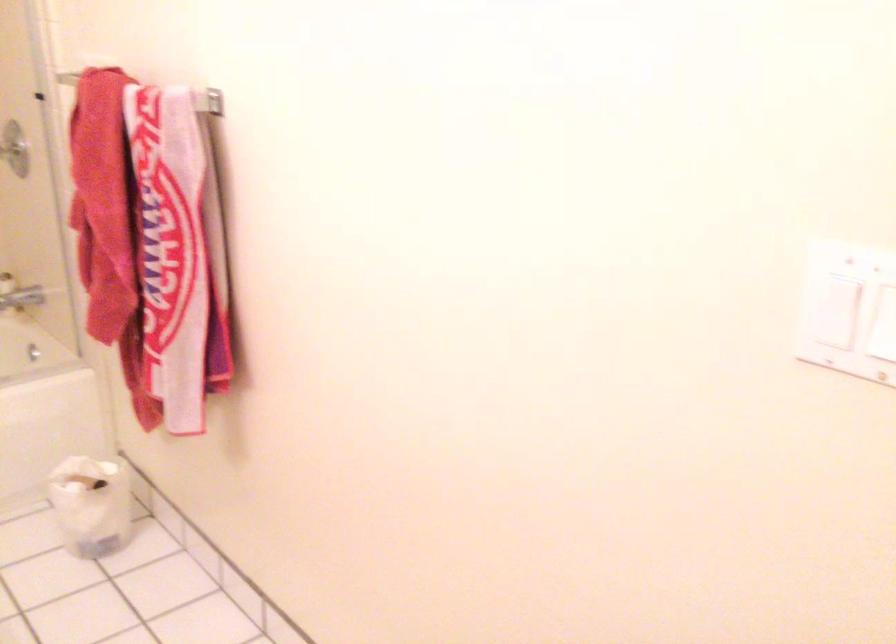
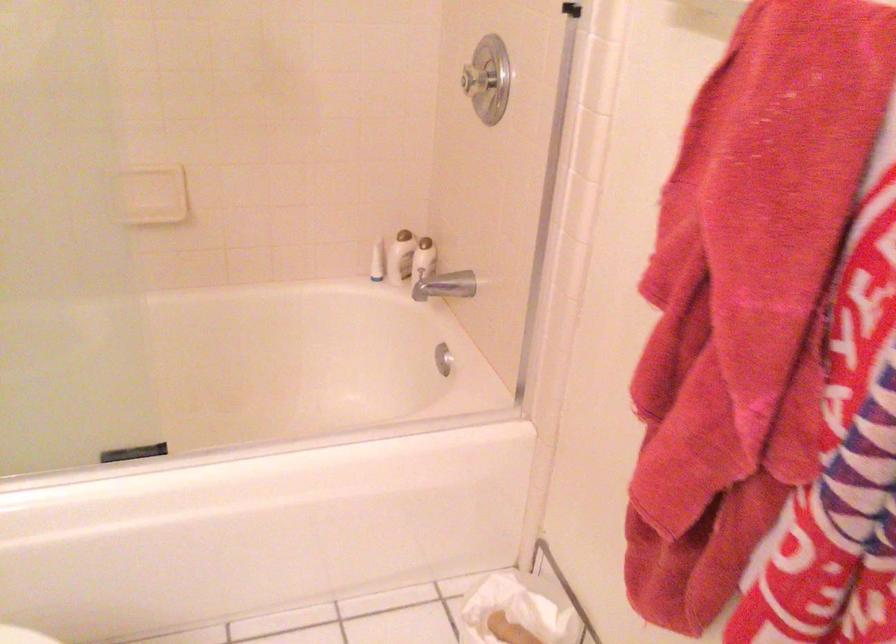
What movement of the cameraman would produce the second image?

The cameraman walked toward left, forward.